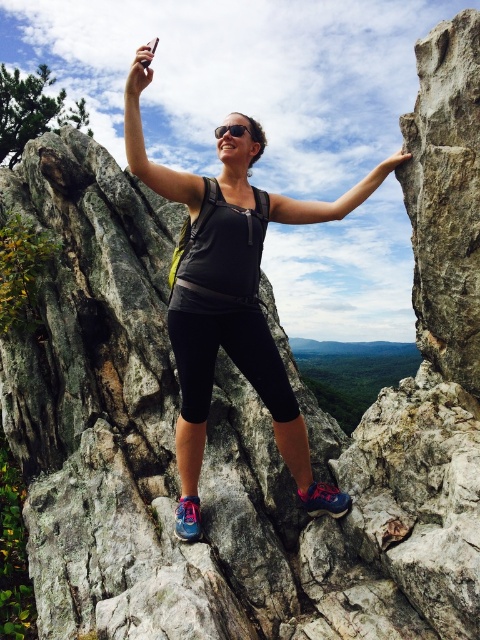
Between point (276, 202) and point (393, 166), which one is positioned behind?

Positioned behind is point (276, 202).

Based on the photo, how much distance is there between black matte arm at upper center and smooth stone hand at upper right?

14.56 inches

Does point (277, 214) lie behind point (405, 161)?

Yes, it is behind point (405, 161).

At what (x,y) coordinates should I click in order to perform the action: click on black matte arm at upper center. Please return your answer as a coordinate pair (x, y). The image size is (480, 640). Looking at the image, I should click on (332, 202).

Is matte black arm at upper center shorter than smooth stone hand at upper right?

Indeed, matte black arm at upper center has a lesser height compared to smooth stone hand at upper right.

The height and width of the screenshot is (640, 480). Find the location of `matte black arm at upper center`. matte black arm at upper center is located at coordinates (144, 144).

Find the location of a particular element. The height and width of the screenshot is (640, 480). matte black arm at upper center is located at coordinates (144, 144).

Based on the photo, can you confirm if matte black tank top at center is bigger than black matte arm at upper center?

No.

In the scene shown: Can you confirm if matte black tank top at center is wider than black matte arm at upper center?

Yes.

Is point (144, 157) closer to viewer compared to point (369, 182)?

That is True.

Identify the location of matte black tank top at center. Image resolution: width=480 pixels, height=640 pixels. (232, 344).